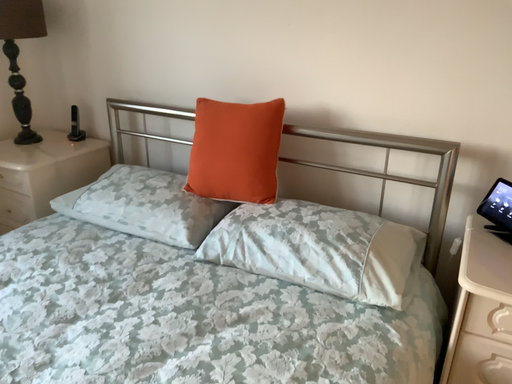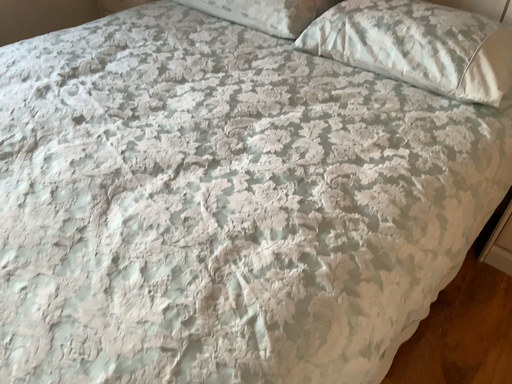
Question: Which way did the camera rotate in the video?

Choices:
 (A) rotated downward
 (B) rotated upward

Answer: (A)